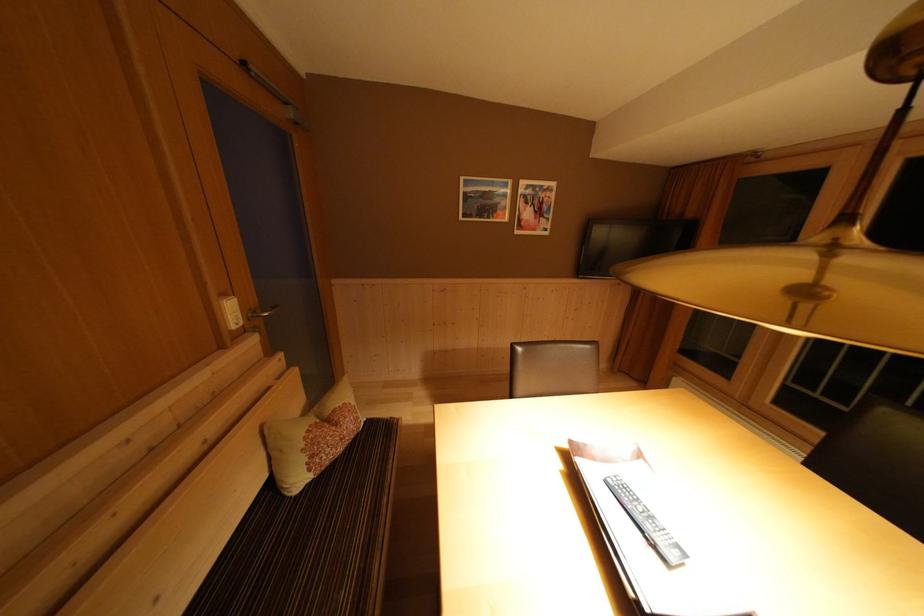
Where is `silver door handle`? silver door handle is located at coordinates (261, 312).